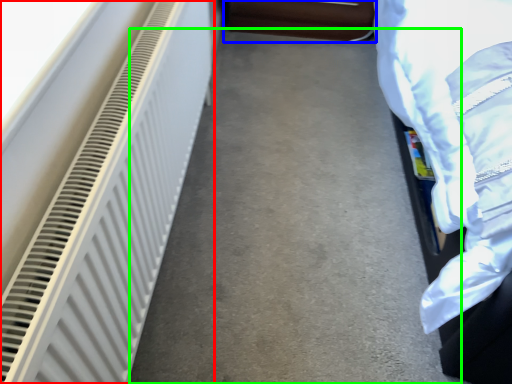
Question: Which object is the farthest from radiator (highlighted by a red box)? Choose among these: furniture (highlighted by a blue box) or concrete (highlighted by a green box).

Choices:
 (A) furniture
 (B) concrete

Answer: (A)